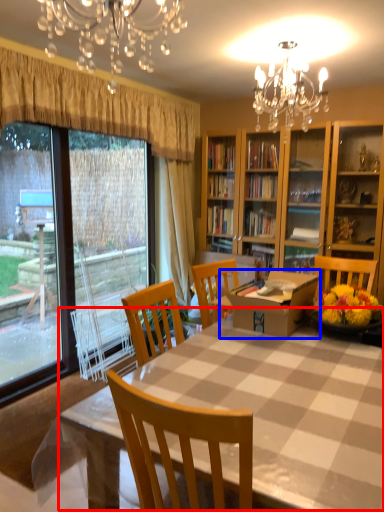
Question: Among these objects, which one is nearest to the camera, kitchen & dining room table (highlighted by a red box) or round table (highlighted by a blue box)?

Choices:
 (A) kitchen & dining room table
 (B) round table

Answer: (A)